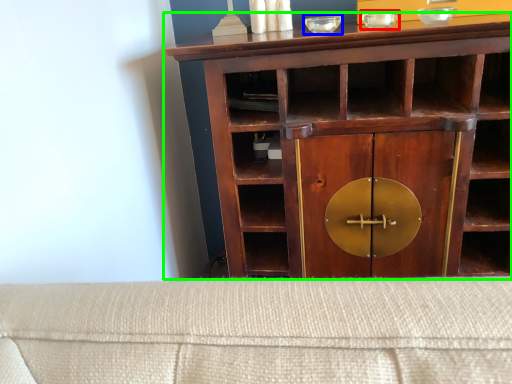
Question: Which is nearer to the glass bowl (highlighted by a red box)? glass bowl (highlighted by a blue box) or cupboard (highlighted by a green box).

Choices:
 (A) glass bowl
 (B) cupboard

Answer: (A)